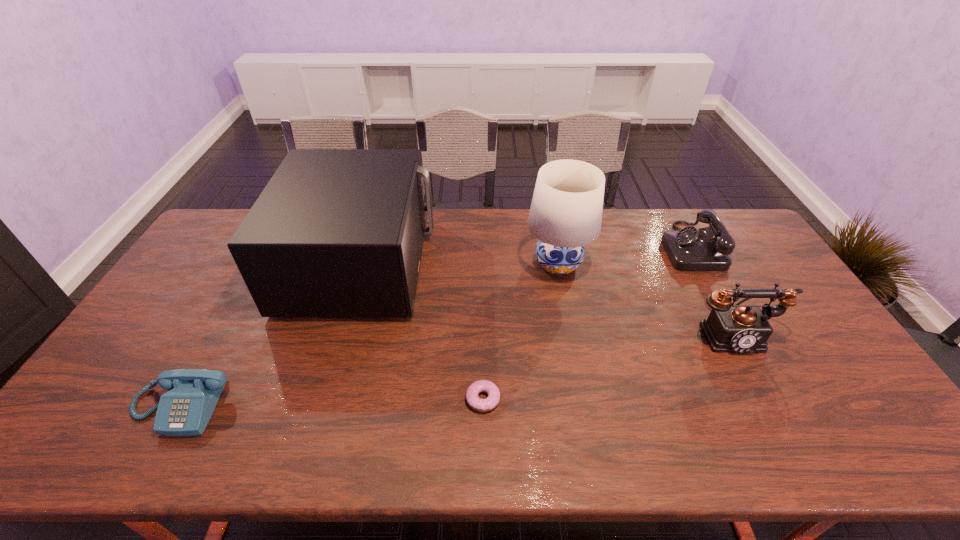
The height and width of the screenshot is (540, 960). Identify the location of the fourth object from left to right. (565, 215).

The width and height of the screenshot is (960, 540). In order to click on microwave oven in this screenshot , I will do `click(336, 232)`.

Where is `the second farthest telephone`? This screenshot has height=540, width=960. the second farthest telephone is located at coordinates (737, 328).

Where is `the tallest telephone`? This screenshot has width=960, height=540. the tallest telephone is located at coordinates (737, 328).

Find the location of `the second tallest telephone`. the second tallest telephone is located at coordinates (690, 249).

This screenshot has width=960, height=540. I want to click on the farthest telephone, so click(690, 249).

Where is `the shortest telephone`? The image size is (960, 540). the shortest telephone is located at coordinates (185, 410).

The image size is (960, 540). I want to click on the leftmost telephone, so click(185, 410).

Image resolution: width=960 pixels, height=540 pixels. Identify the location of the shortest object. (482, 405).

The image size is (960, 540). Find the location of `the third object from left to right`. the third object from left to right is located at coordinates (482, 405).